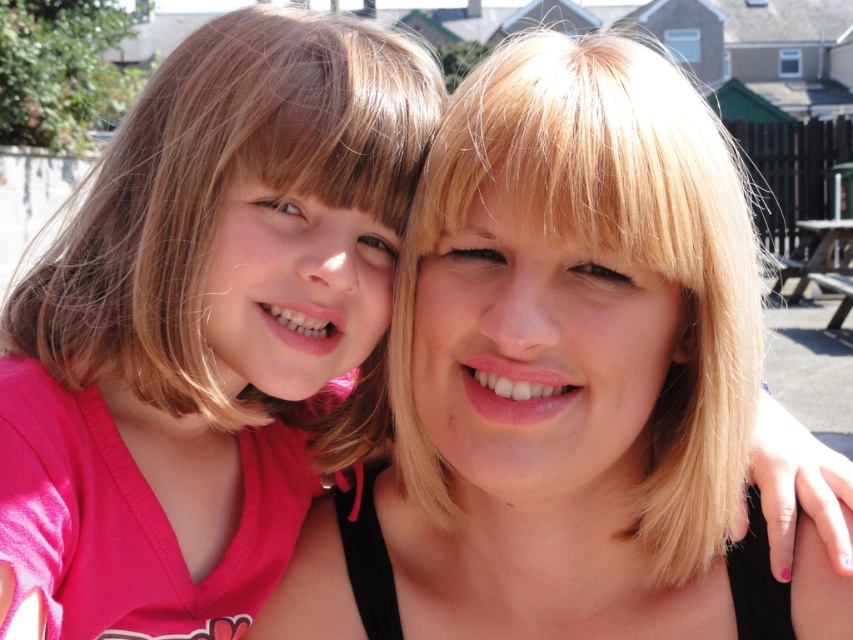
Can you confirm if blonde hair at center is shorter than matte pink shirt at left?

Incorrect, blonde hair at center's height does not fall short of matte pink shirt at left's.

Which of these two, blonde hair at center or matte pink shirt at left, stands shorter?

Standing shorter between the two is matte pink shirt at left.

Does point (767, 616) come farther from viewer compared to point (345, 348)?

Yes, point (767, 616) is behind point (345, 348).

The height and width of the screenshot is (640, 853). In order to click on blonde hair at center in this screenshot , I will do `click(566, 380)`.